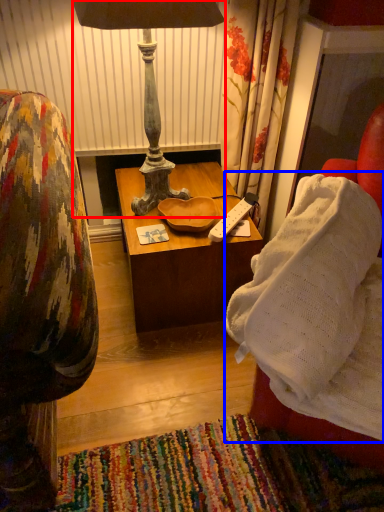
Question: Which object appears farthest to the camera in this image, lamp (highlighted by a red box) or blanket (highlighted by a blue box)?

Choices:
 (A) lamp
 (B) blanket

Answer: (A)